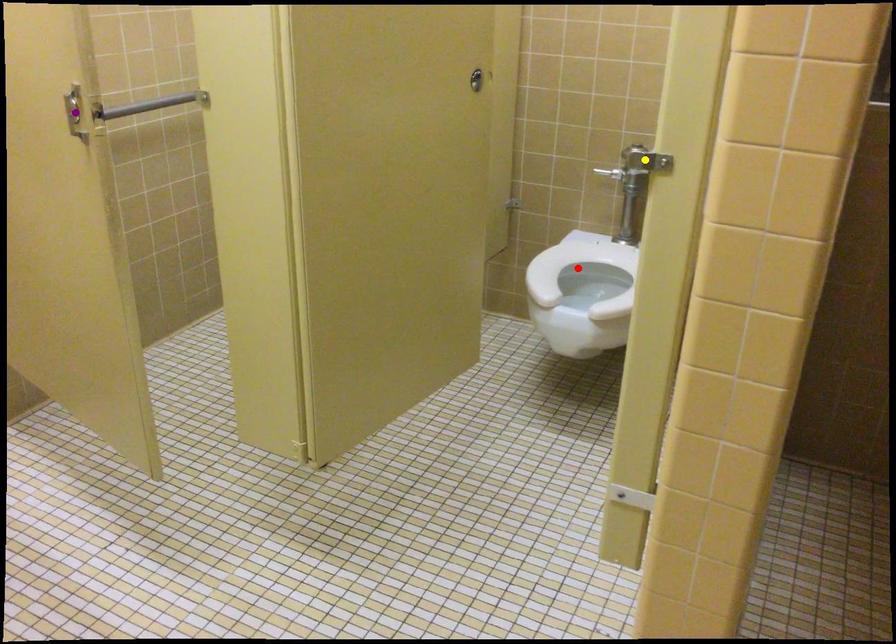
Order these from farthest to nearest:
yellow point
red point
purple point

red point < purple point < yellow point